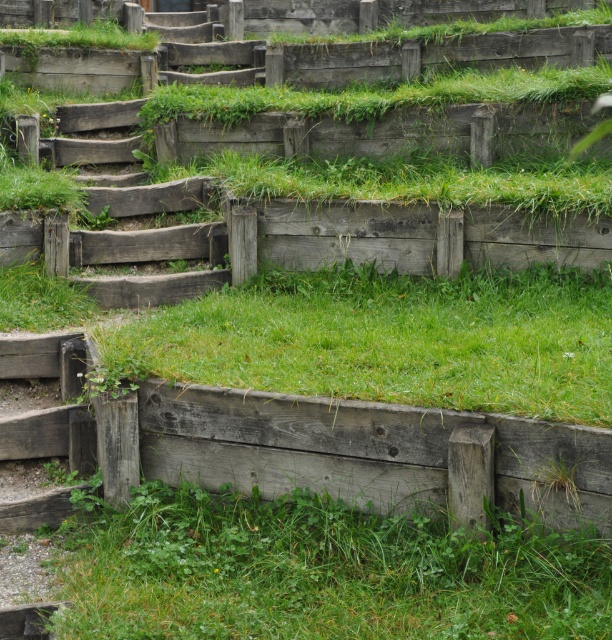
Question: Is green grassy at lower center smaller than green grassy at center?

Choices:
 (A) yes
 (B) no

Answer: (A)

Question: Does green grassy at center have a greater width compared to weathered wood stairs at center?

Choices:
 (A) yes
 (B) no

Answer: (A)

Question: Is green grassy at center above weathered wood stairs at center?

Choices:
 (A) yes
 (B) no

Answer: (B)

Question: Estimate the real-world distances between objects in this image. Which object is farther from the weathered wood stairs at center?

Choices:
 (A) green grassy at lower center
 (B) green grassy at center

Answer: (A)

Question: Which point appears closest to the camera in this image?

Choices:
 (A) (177, 346)
 (B) (163, 289)

Answer: (A)

Question: Which object is positioned closest to the weathered wood stairs at center?

Choices:
 (A) green grassy at lower center
 (B) green grassy at center

Answer: (B)